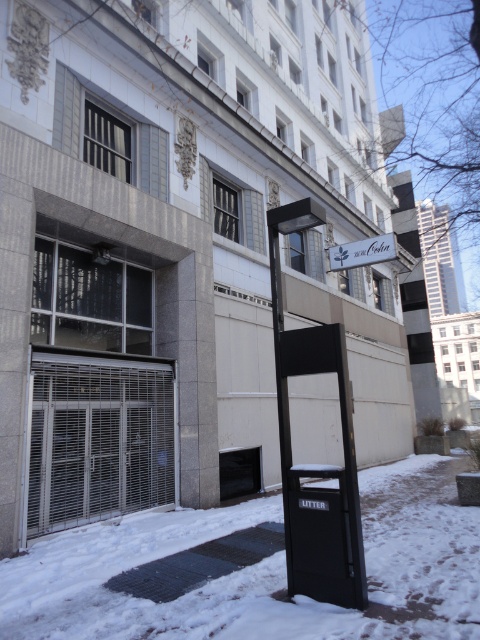
In the scene shown: Who is positioned more to the right, white powdery snow at lower left or white matte sign at upper center?

Positioned to the right is white matte sign at upper center.

Looking at this image, is white powdery snow at lower left to the right of white matte sign at upper center from the viewer's perspective?

In fact, white powdery snow at lower left is to the left of white matte sign at upper center.

What do you see at coordinates (262, 572) in the screenshot? Image resolution: width=480 pixels, height=640 pixels. I see `white powdery snow at lower left` at bounding box center [262, 572].

This screenshot has width=480, height=640. I want to click on white powdery snow at lower left, so click(x=262, y=572).